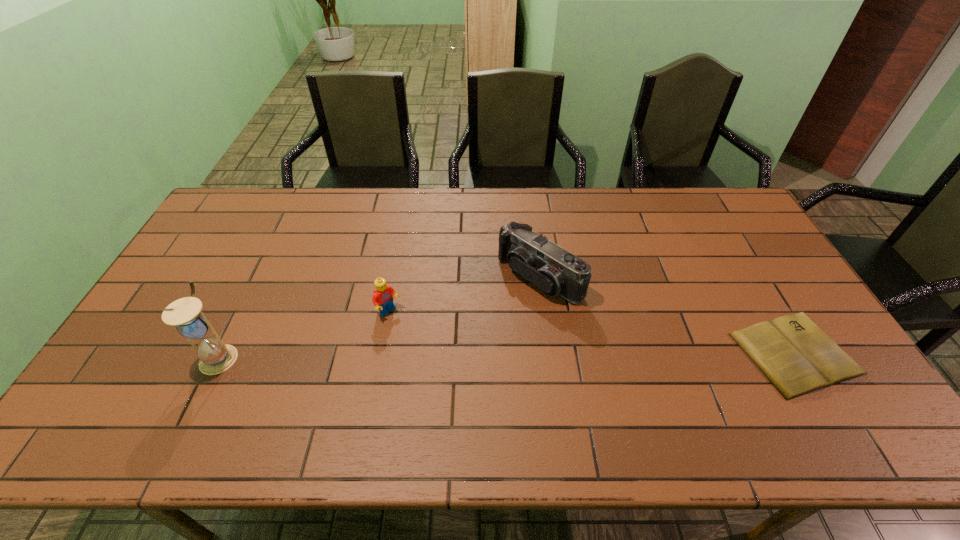
Identify the location of free space on the desktop that is between the tallest object and the book and is positioned on the face of the Lego. Image resolution: width=960 pixels, height=540 pixels. (438, 355).

The height and width of the screenshot is (540, 960). In order to click on free spot on the desktop that is between the tallest object and the book and is positioned on the front-facing side of the third object from left to right in this screenshot , I will do `click(438, 355)`.